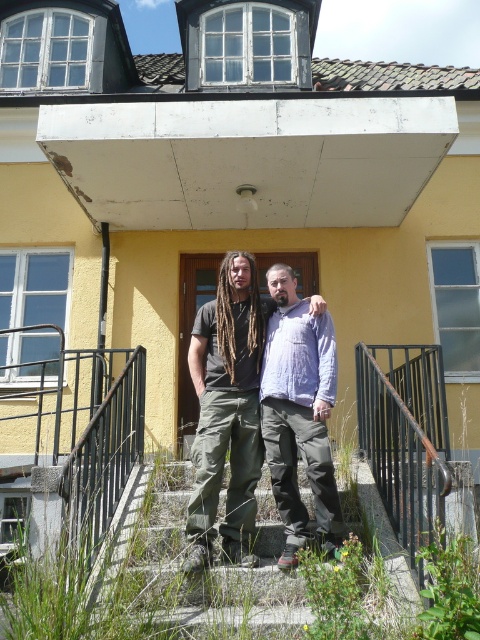
Question: Does matte black shirt at center have a larger size compared to light purple cotton shirt at center?

Choices:
 (A) yes
 (B) no

Answer: (A)

Question: In this image, where is matte black shirt at center located relative to brown dreadlocks at center?

Choices:
 (A) below
 (B) above

Answer: (A)

Question: Can you confirm if concrete stairs at center is positioned below brown dreadlocks at center?

Choices:
 (A) no
 (B) yes

Answer: (B)

Question: Which of the following is the closest to the observer?

Choices:
 (A) concrete stairs at center
 (B) matte black shirt at center
 (C) brown dreadlocks at center

Answer: (A)

Question: Which point is farther to the camera?

Choices:
 (A) brown dreadlocks at center
 (B) matte black shirt at center

Answer: (A)

Question: Among these objects, which one is nearest to the camera?

Choices:
 (A) matte black shirt at center
 (B) concrete stairs at center

Answer: (B)